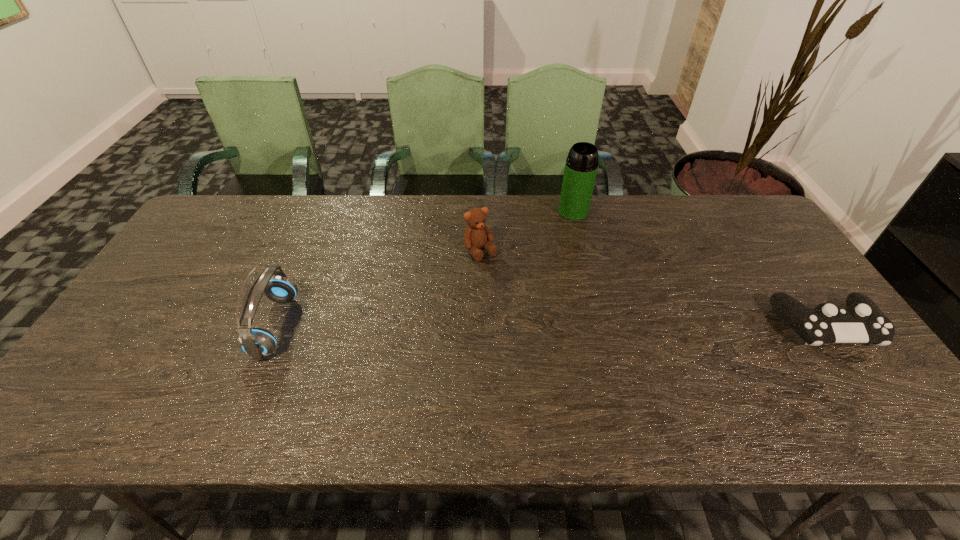
Identify the location of the second tallest object. The image size is (960, 540). (256, 342).

Identify the location of headset. (256, 342).

Locate an element on the screen. The height and width of the screenshot is (540, 960). the shortest object is located at coordinates (862, 321).

Where is `the rightmost object`? Image resolution: width=960 pixels, height=540 pixels. the rightmost object is located at coordinates (862, 321).

Image resolution: width=960 pixels, height=540 pixels. In order to click on the second shortest object in this screenshot , I will do `click(477, 234)`.

The width and height of the screenshot is (960, 540). Identify the location of teddy bear. (477, 234).

Identify the location of the farthest object. (581, 165).

Find the location of a particular element. This screenshot has height=540, width=960. the tallest object is located at coordinates (581, 165).

The height and width of the screenshot is (540, 960). I want to click on vacant space located 0.050m on the ear cups of the leftmost object, so click(x=310, y=326).

At what (x,y) coordinates should I click in order to perform the action: click on vacant region located 0.070m on the surface of the rightmost object. Please return your answer as a coordinate pair (x, y). This screenshot has width=960, height=540. Looking at the image, I should click on (862, 377).